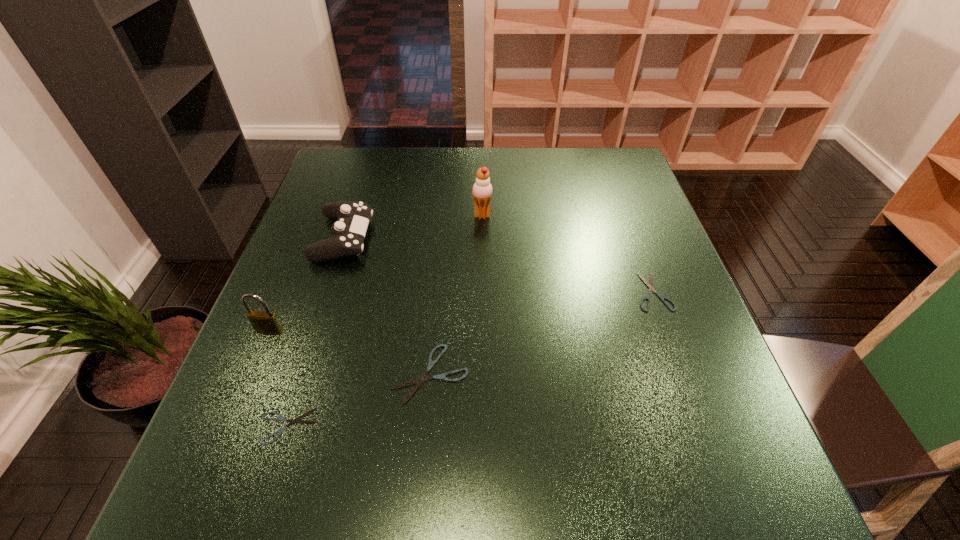
Identify the location of the second tallest object. The image size is (960, 540). pyautogui.click(x=266, y=322).

At what (x,y) coordinates should I click in order to perform the action: click on vacant space located 0.100m on the right of the leftmost shears. Please return your answer as a coordinate pair (x, y). The image size is (960, 540). Looking at the image, I should click on (373, 427).

This screenshot has width=960, height=540. I want to click on vacant region located 0.090m on the back of the second shears from right to left, so click(436, 310).

Find the location of a particular element. The width and height of the screenshot is (960, 540). free location located on the back of the rightmost object is located at coordinates (626, 219).

Find the location of `free space located at the front with a straw on the icecream`. free space located at the front with a straw on the icecream is located at coordinates (443, 215).

Where is `free spot located 0.170m at the front with a straw on the icecream`? This screenshot has width=960, height=540. free spot located 0.170m at the front with a straw on the icecream is located at coordinates pos(409,215).

Identify the location of vacant space situated at the front with a straw on the icecream. The width and height of the screenshot is (960, 540). (360, 215).

The height and width of the screenshot is (540, 960). I want to click on free point located on the surface of the control, so click(390, 238).

In order to click on free spot located 0.080m on the right of the padlock in this screenshot , I will do `click(322, 331)`.

Find the location of a particular element. shears that is at the left edge is located at coordinates (291, 421).